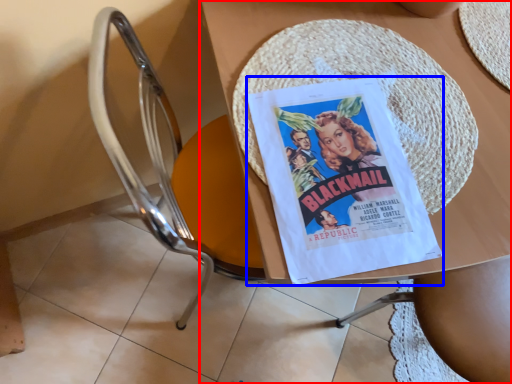
Question: Which object is closer to the camera taking this photo, table (highlighted by a red box) or comic book (highlighted by a blue box)?

Choices:
 (A) table
 (B) comic book

Answer: (A)